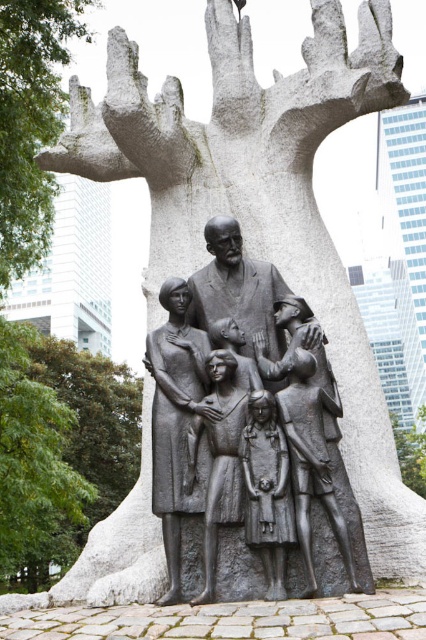
You are a park visitor standing at the base of the green leafy tree at lower left. You want to walk straight towards the gray stone tree trunk at center. How far will you have to walk to reach it?

You will have to walk 84.82 meters to reach the gray stone tree trunk at center from the green leafy tree at lower left.

You are standing in front of the sculpture and want to take a photo that includes both the sculpture and the green leafy tree at lower left. Based on their positions, where should you position yourself to capture both in the frame?

To capture both the sculpture and the green leafy tree at lower left in the frame, position yourself at the lower left side since the green leafy tree at lower left is located at point (34, 460), which is near the lower left corner of the image.

You are an urban planner assessing the space around the sculpture. The gray stone tree trunk at upper center and the green leafy tree at lower left are both in the vicinity. Which tree has a wider base?

The green leafy tree at lower left has a wider base than the gray stone tree trunk at upper center.